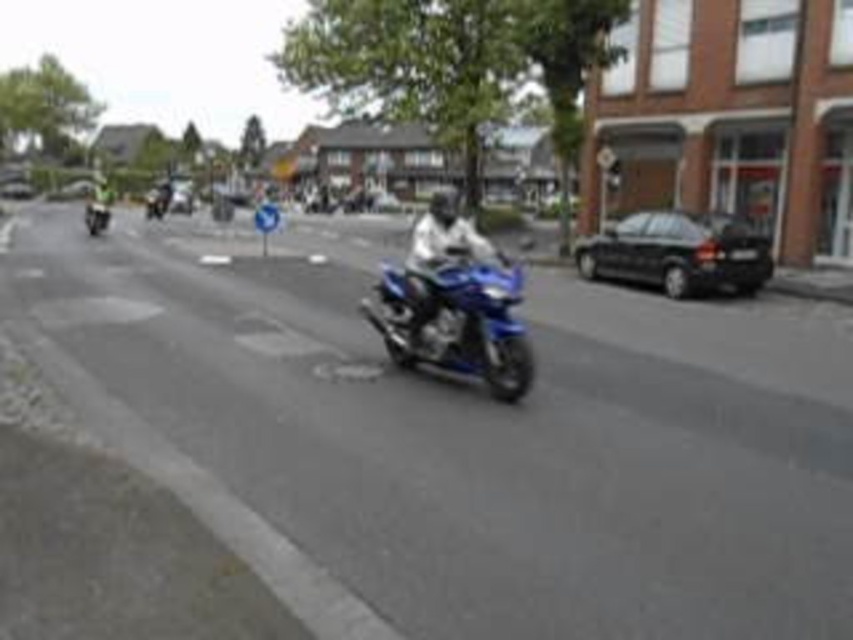
Question: Among these points, which one is farthest from the camera?

Choices:
 (A) (730, 216)
 (B) (90, 202)
 (C) (160, 189)

Answer: (B)

Question: Does black glossy car at right appear under shiny blue motorcycle at left?

Choices:
 (A) yes
 (B) no

Answer: (A)

Question: Which point appears closest to the camera in this image?

Choices:
 (A) (94, 214)
 (B) (445, 208)

Answer: (B)

Question: Is shiny metallic motorcycle at upper left positioned in front of shiny blue motorcycle at left?

Choices:
 (A) yes
 (B) no

Answer: (B)

Question: Which point is closer to the camera?

Choices:
 (A) (509, 348)
 (B) (157, 195)

Answer: (A)

Question: Is white leather jacket at center smaller than shiny blue motorcycle at left?

Choices:
 (A) yes
 (B) no

Answer: (B)